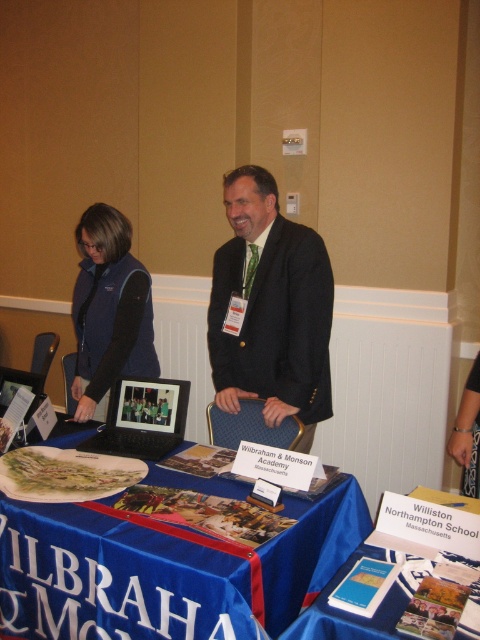
Is point (88, 316) less distant than point (140, 403)?

No, it is not.

Measure the distance between point (128, 349) and camera.

A distance of 7.51 feet exists between point (128, 349) and camera.

Find the location of a particular element. The image size is (480, 640). matte blue vest at center is located at coordinates (108, 308).

Looking at this image, is dark suit at center smaller than blue fabric table at center?

Actually, dark suit at center might be larger than blue fabric table at center.

What do you see at coordinates (271, 308) in the screenshot? The height and width of the screenshot is (640, 480). I see `dark suit at center` at bounding box center [271, 308].

Identify the location of dark suit at center. (271, 308).

Can you confirm if blue fabric tablecloth at center is wider than matte blue vest at center?

Indeed, blue fabric tablecloth at center has a greater width compared to matte blue vest at center.

Consider the image. Can you confirm if blue fabric tablecloth at center is bigger than matte blue vest at center?

Yes, blue fabric tablecloth at center is bigger than matte blue vest at center.

Which is in front, point (122, 572) or point (100, 413)?

Point (122, 572) is in front.

The height and width of the screenshot is (640, 480). Identify the location of blue fabric tablecloth at center. (165, 570).